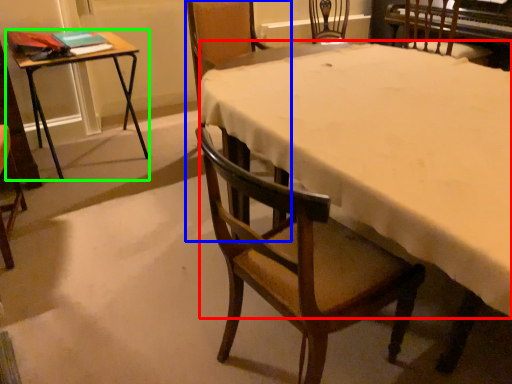
Question: Estimate the real-world distances between objects in this image. Which object is farther from tablecloth (highlighted by a red box), chair (highlighted by a blue box) or table (highlighted by a green box)?

Choices:
 (A) chair
 (B) table

Answer: (B)